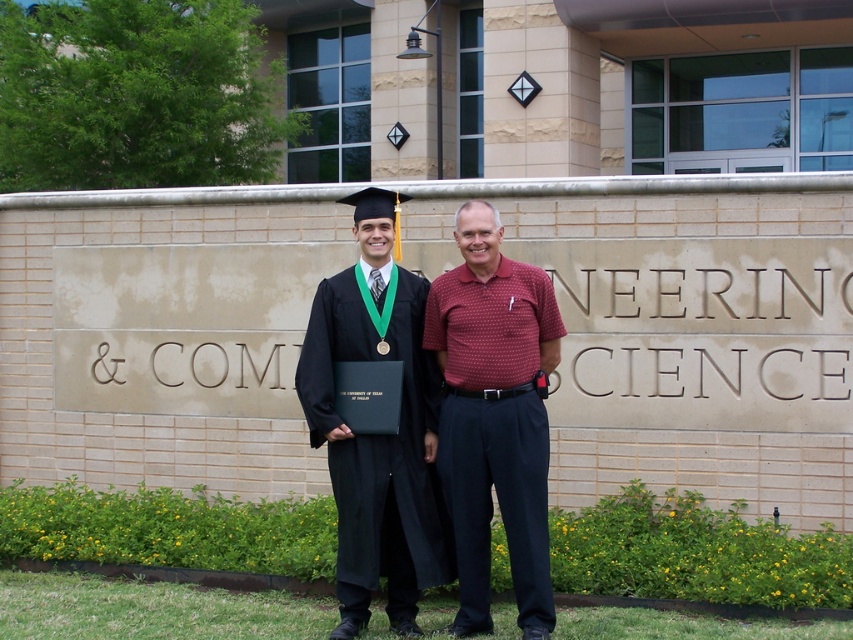
Is matte black graduation gown at center bigger than black matte gown at center?

Yes, matte black graduation gown at center is bigger than black matte gown at center.

The width and height of the screenshot is (853, 640). Describe the element at coordinates (376, 422) in the screenshot. I see `matte black graduation gown at center` at that location.

Which is in front, point (305, 339) or point (396, 561)?

Point (396, 561)

This screenshot has height=640, width=853. Find the location of `matte black graduation gown at center`. matte black graduation gown at center is located at coordinates pyautogui.click(x=376, y=422).